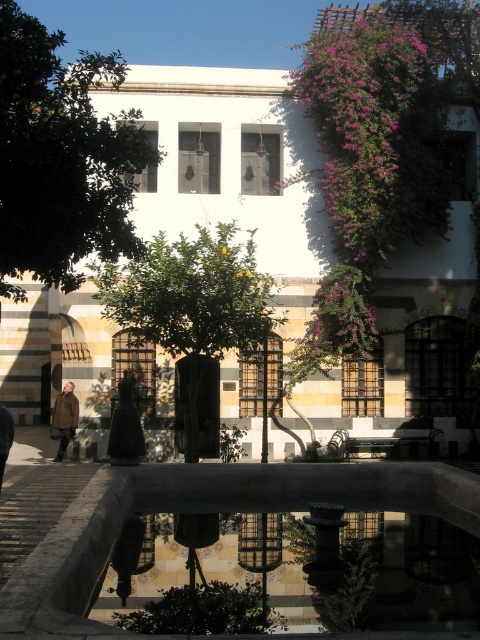
You are standing in the courtyard and want to take a photo of the green leafy tree at center and the brown woolen coat at lower left. Which object should you focus on first to ensure both are in the frame?

You should focus on the green leafy tree at center first because it is closer to the viewer than the brown woolen coat at lower left, so adjusting the camera to focus on the closer object will help both be in the frame.

You are standing in the courtyard and want to place a 2.5 meter wide bench between the green leafy tree at upper left and the fountain. Can you fit it there?

The distance between the green leafy tree at upper left and the fountain is 6.55 meters, so a 2.5 meter wide bench can be placed there with enough space remaining.

You are standing in the courtyard and want to place a small statue on the ground near the brown woolen coat at lower left without blocking the view of the green leafy tree at center. Is this possible?

The green leafy tree at center is located above the brown woolen coat at lower left, so placing the statue near the brown woolen coat at lower left would not block the view of the green leafy tree at center since it is positioned below it.